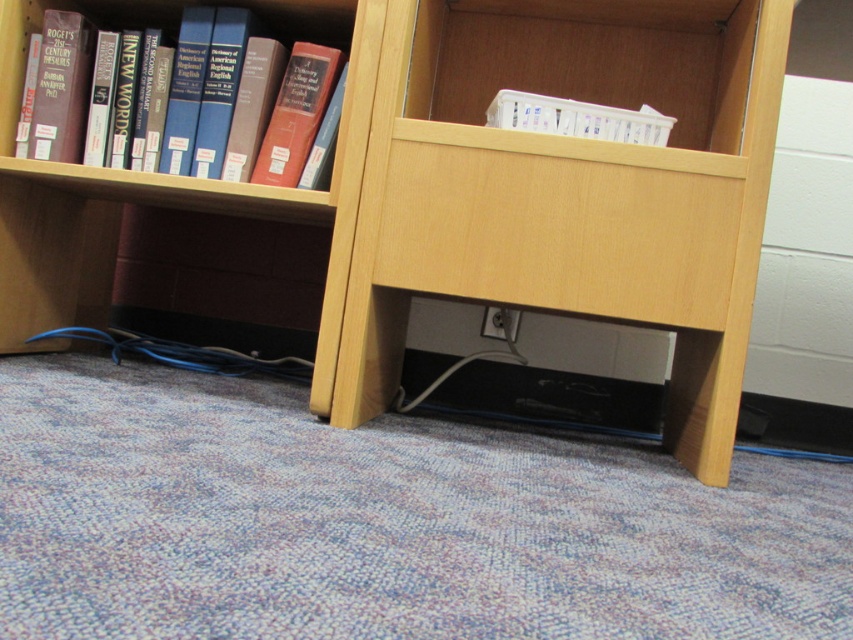
You are organizing items on a bookshelf and need to place both the hardcover book at left and the white plastic container at upper center. Given their sizes, which item should you place first to ensure proper arrangement?

The hardcover book at left should be placed first since it occupies less space than the white plastic container at upper center, allowing for better organization.

You are organizing a small library and need to place a new book that is the same size as the hardcover book at left. Where would you place it to ensure it fits properly on the wooden bookcase at lower center?

Since the wooden bookcase at lower center is larger than the hardcover book at left, you can place the new book on any shelf of the wooden bookcase at lower center where there is enough space, as the bookcase has sufficient size to accommodate the book.